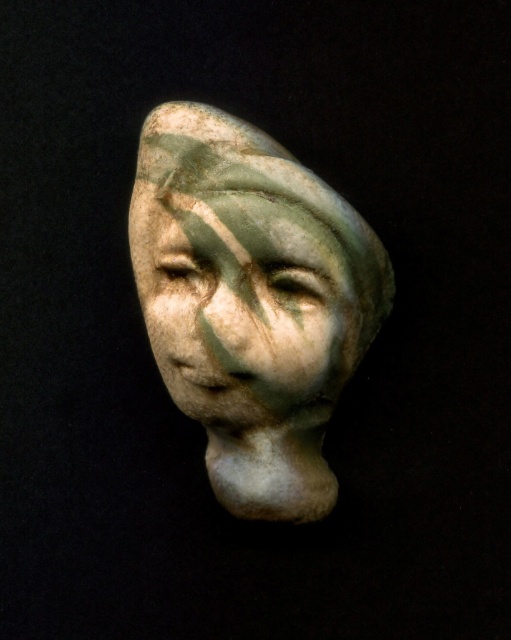
Question: In this image, where is green marble head at center located relative to matte green stone face at center?

Choices:
 (A) right
 (B) left

Answer: (A)

Question: Among these objects, which one is farthest from the camera?

Choices:
 (A) matte green stone face at center
 (B) green marble head at center

Answer: (B)

Question: From the image, what is the correct spatial relationship of green marble head at center in relation to matte green stone face at center?

Choices:
 (A) above
 (B) below

Answer: (B)

Question: Can you confirm if green marble head at center is wider than matte green stone face at center?

Choices:
 (A) yes
 (B) no

Answer: (A)